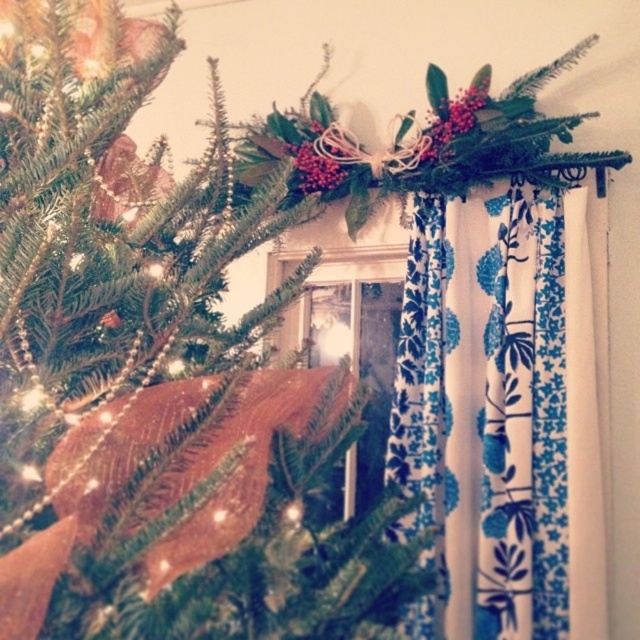
You are standing in front of the Christmas tree and want to hang an ornament at point (x=157, y=385). Based on the scene description, where exactly on the Christmas tree is this point located?

Point (x=157, y=385) is on the green matte Christmas tree at upper left.

You are planning to hang a new decoration on the green matte christmas tree at upper left and the blue floral fabric curtain at upper center. Which object will require you to stand on a stool to reach it?

The blue floral fabric curtain at upper center requires standing on a stool because it is taller than the green matte christmas tree at upper left.